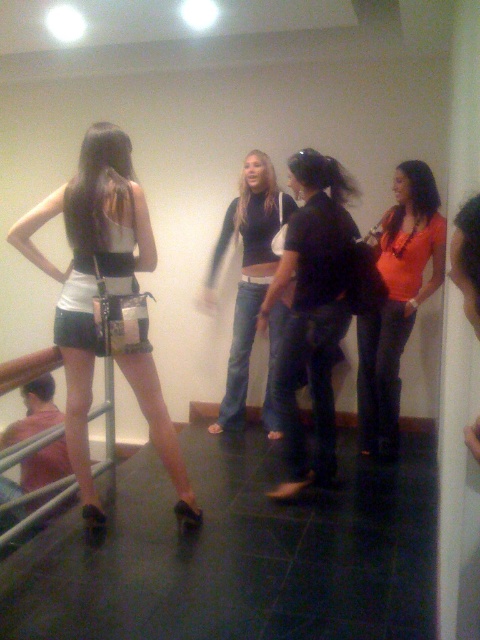
Question: Which point appears farthest from the camera in this image?

Choices:
 (A) (74, 412)
 (B) (301, 164)
 (C) (237, 301)

Answer: (C)

Question: Is orange jersey at center wider than jeans at center?

Choices:
 (A) yes
 (B) no

Answer: (B)

Question: Which point is closer to the camera taking this photo?

Choices:
 (A) (300, 272)
 (B) (140, 260)
 (C) (409, 250)
 (D) (277, 301)

Answer: (B)

Question: Which point is closer to the camera?

Choices:
 (A) denim jeans at center
 (B) orange jersey at center
 (C) jeans at center

Answer: (A)

Question: Does denim jeans at center have a larger size compared to jeans at center?

Choices:
 (A) yes
 (B) no

Answer: (B)

Question: Is denim jeans at center further to camera compared to jeans at center?

Choices:
 (A) no
 (B) yes

Answer: (A)